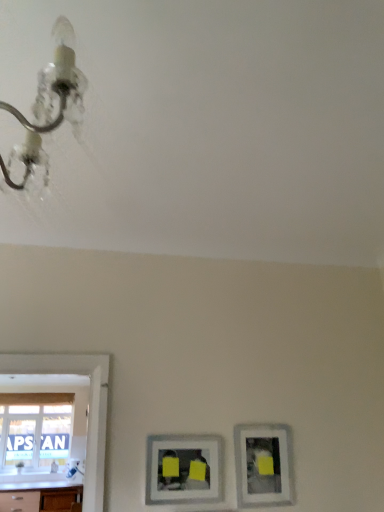
Where is `matte silver picture frame at lower right, which is counted as the 1th picture frame, starting from the right`? The image size is (384, 512). matte silver picture frame at lower right, which is counted as the 1th picture frame, starting from the right is located at coordinates (264, 465).

Image resolution: width=384 pixels, height=512 pixels. What do you see at coordinates (35, 429) in the screenshot?
I see `transparent glass window at lower left` at bounding box center [35, 429].

What do you see at coordinates (184, 469) in the screenshot? The height and width of the screenshot is (512, 384). I see `matte silver picture frame at lower center, marked as the first picture frame in a left-to-right arrangement` at bounding box center [184, 469].

What is the approximate height of matte silver picture frame at lower center, marked as the first picture frame in a left-to-right arrangement?

matte silver picture frame at lower center, marked as the first picture frame in a left-to-right arrangement, is 11.28 inches in height.

Locate an element on the screen. The image size is (384, 512). matte silver picture frame at lower right, which is counted as the 1th picture frame, starting from the right is located at coordinates (264, 465).

Is white glossy countertop at lower left spatially inside metallic chandelier at upper left, or outside of it?

white glossy countertop at lower left is not inside metallic chandelier at upper left, it's outside.

Is white glossy countertop at lower left closer to the viewer compared to metallic chandelier at upper left?

No.

Are white glossy countertop at lower left and metallic chandelier at upper left beside each other?

No.

Who is bigger, matte silver picture frame at lower center, the second picture frame positioned from the right, or matte silver picture frame at lower right, the second picture frame positioned from the left?

With larger size is matte silver picture frame at lower right, the second picture frame positioned from the left.

Is matte silver picture frame at lower center, marked as the first picture frame in a left-to-right arrangement, taller or shorter than matte silver picture frame at lower right, which is counted as the 1th picture frame, starting from the right?

Considering their sizes, matte silver picture frame at lower center, marked as the first picture frame in a left-to-right arrangement, has less height than matte silver picture frame at lower right, which is counted as the 1th picture frame, starting from the right.

This screenshot has width=384, height=512. Identify the location of picture frame lying on the right of matte silver picture frame at lower center, marked as the first picture frame in a left-to-right arrangement. (264, 465).

Choose the correct answer: Is matte silver picture frame at lower right, the second picture frame positioned from the left, inside metallic chandelier at upper left or outside it?

matte silver picture frame at lower right, the second picture frame positioned from the left, cannot be found inside metallic chandelier at upper left.

Is matte silver picture frame at lower right, the second picture frame positioned from the left, beside metallic chandelier at upper left?

No, matte silver picture frame at lower right, the second picture frame positioned from the left, is not next to metallic chandelier at upper left.

Is matte silver picture frame at lower right, the second picture frame positioned from the left, positioned with its back to metallic chandelier at upper left?

No, matte silver picture frame at lower right, the second picture frame positioned from the left, is not facing the opposite direction of metallic chandelier at upper left.

How much distance is there between transparent glass window at lower left and matte silver picture frame at lower right, which is counted as the 1th picture frame, starting from the right?

They are 1.35 meters apart.

Is point (16, 438) farther from viewer compared to point (251, 506)?

Yes, it is behind point (251, 506).

Considering the relative sizes of transparent glass window at lower left and matte silver picture frame at lower right, which is counted as the 1th picture frame, starting from the right, in the image provided, is transparent glass window at lower left bigger than matte silver picture frame at lower right, which is counted as the 1th picture frame, starting from the right,?

Correct, transparent glass window at lower left is larger in size than matte silver picture frame at lower right, which is counted as the 1th picture frame, starting from the right.

Is transparent glass window at lower left not within matte silver picture frame at lower right, which is counted as the 1th picture frame, starting from the right?

Yes, transparent glass window at lower left is not within matte silver picture frame at lower right, which is counted as the 1th picture frame, starting from the right.

Would you say metallic chandelier at upper left is to the left or to the right of transparent glass window at lower left in the picture?

From the image, it's evident that metallic chandelier at upper left is to the right of transparent glass window at lower left.

From a real-world perspective, which object rests below the other?

transparent glass window at lower left, from a real-world perspective.

Is transparent glass window at lower left surrounded by metallic chandelier at upper left?

No, metallic chandelier at upper left does not contain transparent glass window at lower left.

Is metallic chandelier at upper left oriented towards transparent glass window at lower left?

No, metallic chandelier at upper left does not turn towards transparent glass window at lower left.

Is transparent glass window at lower left further to the viewer compared to matte silver picture frame at lower center, marked as the first picture frame in a left-to-right arrangement?

Yes, the depth of transparent glass window at lower left is greater than that of matte silver picture frame at lower center, marked as the first picture frame in a left-to-right arrangement.

How much distance is there between transparent glass window at lower left and matte silver picture frame at lower center, marked as the first picture frame in a left-to-right arrangement?

transparent glass window at lower left and matte silver picture frame at lower center, marked as the first picture frame in a left-to-right arrangement, are 1.08 meters apart from each other.

From a real-world perspective, is transparent glass window at lower left above or below matte silver picture frame at lower center, marked as the first picture frame in a left-to-right arrangement?

Clearly, from a real-world perspective, transparent glass window at lower left is below matte silver picture frame at lower center, marked as the first picture frame in a left-to-right arrangement.

Is transparent glass window at lower left to the right of matte silver picture frame at lower center, marked as the first picture frame in a left-to-right arrangement, from the viewer's perspective?

No.

Could you measure the distance between matte silver picture frame at lower center, marked as the first picture frame in a left-to-right arrangement, and white glossy countertop at lower left?

matte silver picture frame at lower center, marked as the first picture frame in a left-to-right arrangement, and white glossy countertop at lower left are 39.08 inches apart from each other.

Considering the positions of point (191, 492) and point (77, 493), is point (191, 492) closer or farther from the camera than point (77, 493)?

Clearly, point (191, 492) is closer to the camera than point (77, 493).

From the image's perspective, which is below, matte silver picture frame at lower center, marked as the first picture frame in a left-to-right arrangement, or white glossy countertop at lower left?

white glossy countertop at lower left is shown below in the image.

Where is `counter top below the metallic chandelier at upper left (from a real-world perspective)`? Image resolution: width=384 pixels, height=512 pixels. counter top below the metallic chandelier at upper left (from a real-world perspective) is located at coordinates (42, 498).

You are a GUI agent. You are given a task and a screenshot of the screen. Output one action in this format:
    pyautogui.click(x=<x>, y=<y>)
    Task: Click on the picture frame that is on the right side of matte silver picture frame at lower center, marked as the first picture frame in a left-to-right arrangement
    The height and width of the screenshot is (512, 384).
    Given the screenshot: What is the action you would take?
    pyautogui.click(x=264, y=465)

Considering their positions, is metallic chandelier at upper left positioned closer to matte silver picture frame at lower right, which is counted as the 1th picture frame, starting from the right, than transparent glass window at lower left?

Among the two, transparent glass window at lower left is located nearer to matte silver picture frame at lower right, which is counted as the 1th picture frame, starting from the right.

Which object lies nearer to the anchor point metallic chandelier at upper left, matte silver picture frame at lower right, the second picture frame positioned from the left, or transparent glass window at lower left?

matte silver picture frame at lower right, the second picture frame positioned from the left, lies closer to metallic chandelier at upper left than the other object.

Which object lies nearer to the anchor point matte silver picture frame at lower right, the second picture frame positioned from the left, white glossy countertop at lower left or transparent glass window at lower left?

white glossy countertop at lower left is positioned closer to the anchor matte silver picture frame at lower right, the second picture frame positioned from the left.

In the scene shown: Looking at the image, which one is located further to transparent glass window at lower left, white glossy countertop at lower left or matte silver picture frame at lower right, the second picture frame positioned from the left?

matte silver picture frame at lower right, the second picture frame positioned from the left.

Looking at the image, which one is located closer to transparent glass window at lower left, matte silver picture frame at lower right, which is counted as the 1th picture frame, starting from the right, or matte silver picture frame at lower center, the second picture frame positioned from the right?

matte silver picture frame at lower center, the second picture frame positioned from the right.

Estimate the real-world distances between objects in this image. Which object is further from white glossy countertop at lower left, matte silver picture frame at lower right, which is counted as the 1th picture frame, starting from the right, or matte silver picture frame at lower center, the second picture frame positioned from the right?

Based on the image, matte silver picture frame at lower right, which is counted as the 1th picture frame, starting from the right, appears to be further to white glossy countertop at lower left.

Estimate the real-world distances between objects in this image. Which object is further from matte silver picture frame at lower center, the second picture frame positioned from the right, white glossy countertop at lower left or matte silver picture frame at lower right, which is counted as the 1th picture frame, starting from the right?

white glossy countertop at lower left is positioned further to the anchor matte silver picture frame at lower center, the second picture frame positioned from the right.

Looking at this image, which object lies further to the anchor point metallic chandelier at upper left, white glossy countertop at lower left or matte silver picture frame at lower right, which is counted as the 1th picture frame, starting from the right?

Based on the image, white glossy countertop at lower left appears to be further to metallic chandelier at upper left.

At what (x,y) coordinates should I click in order to perform the action: click on picture frame located between metallic chandelier at upper left and matte silver picture frame at lower right, which is counted as the 1th picture frame, starting from the right, in the depth direction. Please return your answer as a coordinate pair (x, y). This screenshot has width=384, height=512. Looking at the image, I should click on (184, 469).

In order to click on picture frame between matte silver picture frame at lower center, the second picture frame positioned from the right, and white glossy countertop at lower left, along the z-axis in this screenshot , I will do `click(264, 465)`.

The width and height of the screenshot is (384, 512). Identify the location of counter top positioned between metallic chandelier at upper left and transparent glass window at lower left from near to far. click(x=42, y=498).

Where is `counter top positioned between matte silver picture frame at lower right, which is counted as the 1th picture frame, starting from the right, and transparent glass window at lower left from near to far`? This screenshot has height=512, width=384. counter top positioned between matte silver picture frame at lower right, which is counted as the 1th picture frame, starting from the right, and transparent glass window at lower left from near to far is located at coordinates (42, 498).